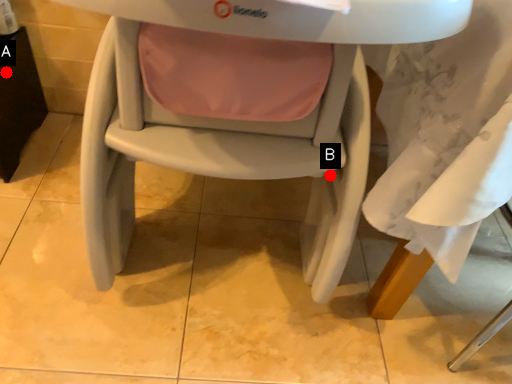
Question: Two points are circled on the image, labeled by A and B beside each circle. Among these points, which one is nearest to the camera?

Choices:
 (A) A is closer
 (B) B is closer

Answer: (B)